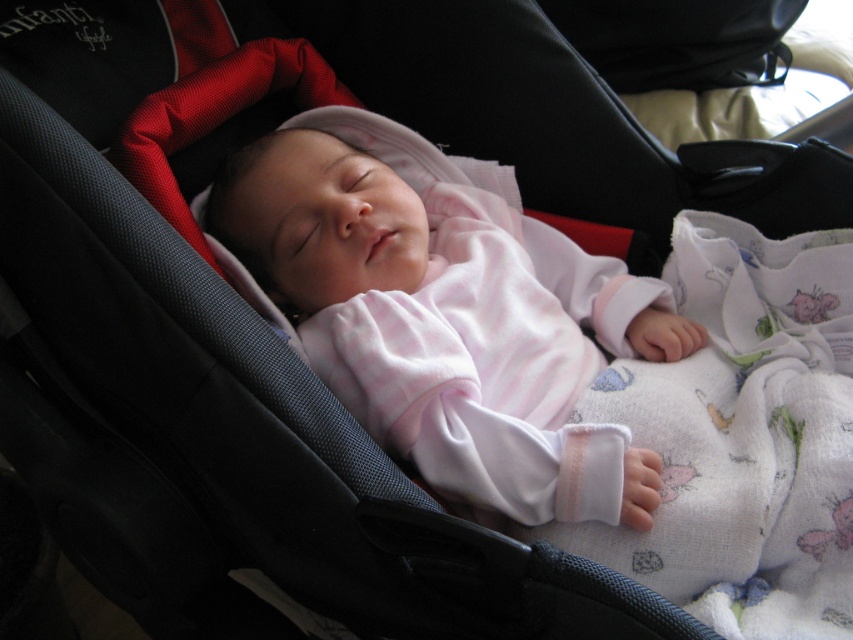
You are a parent trying to ensure your baby stays warm in the car seat. The car seat has a small storage compartment at the back. You have the pink soft fabric baby at center and the white cotton blanket at lower right. Which item should you adjust to make sure the baby is properly covered?

The pink soft fabric baby at center is much taller than the white cotton blanket at lower right, so you should adjust the white cotton blanket at lower right to ensure it covers the baby adequately.

You are a parent holding a white cotton blanket at lower right and want to cover the pink soft fabric baby at center. Can you place the blanket over the baby without moving the baby?

The pink soft fabric baby at center is further to the viewer than the white cotton blanket at lower right, so you can place the blanket over the baby without moving them by positioning it behind the baby.